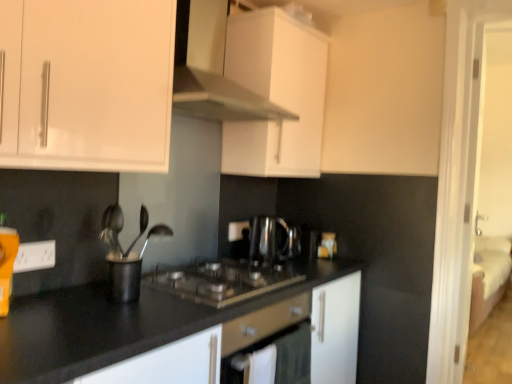
Locate an element on the screen. vacant space positioned to the left of satin black coffee machine at center is located at coordinates (230, 263).